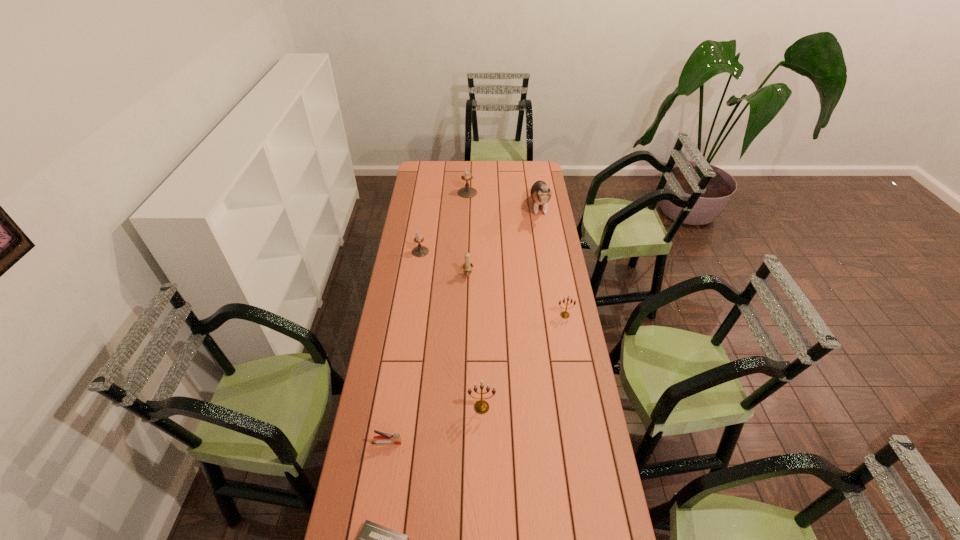
What are the coordinates of `the second shortest object` in the screenshot? It's located at tap(383, 438).

This screenshot has width=960, height=540. In order to click on the second nearest object in this screenshot , I will do `click(383, 438)`.

This screenshot has height=540, width=960. Identify the location of vacant space located 0.360m at the face of the tallest object. (550, 276).

Locate an element on the screen. free space located on the left of the farthest candelabrum is located at coordinates (435, 193).

This screenshot has width=960, height=540. I want to click on vacant area situated 0.270m on the left of the nearest candelabrum, so click(x=393, y=407).

The height and width of the screenshot is (540, 960). I want to click on vacant space located 0.330m on the handle side of the fourth farthest object, so click(x=466, y=339).

Image resolution: width=960 pixels, height=540 pixels. In order to click on free space located 0.170m on the back of the nearer purple candle holder in this screenshot , I will do `click(424, 225)`.

At what (x,y) coordinates should I click in order to perform the action: click on vacant area situated on the front of the smaller gold candelabrum. Please return your answer as a coordinate pair (x, y). Looking at the image, I should click on (574, 362).

Locate an element on the screen. This screenshot has height=540, width=960. vacant position located on the handle side of the seventh farthest object is located at coordinates (470, 442).

I want to click on candle holder at the left edge, so click(x=419, y=251).